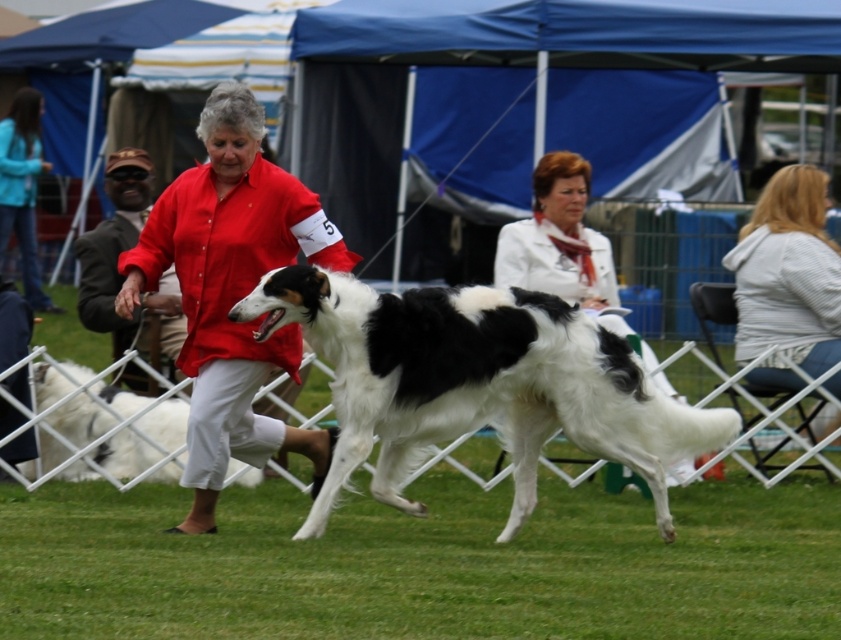
Can you confirm if light gray striped sweater at right is bigger than white fluffy dog at center?

Yes.

Is point (757, 246) positioned behind point (136, 456)?

Yes, it is behind point (136, 456).

Find the location of a particular element. The image size is (841, 640). light gray striped sweater at right is located at coordinates (787, 280).

Between point (252, 477) and point (6, 164), which one is positioned in front?

Point (252, 477) is more forward.

Who is positioned more to the left, white fluffy dog at center or matte teal jacket at upper left?

matte teal jacket at upper left is more to the left.

Image resolution: width=841 pixels, height=640 pixels. What do you see at coordinates (147, 444) in the screenshot? I see `white fluffy dog at center` at bounding box center [147, 444].

I want to click on white fluffy dog at center, so click(147, 444).

Does point (231, 180) come behind point (90, 240)?

No, it is not.

Between matte red shirt at center and red cotton shirt at center, which one is positioned lower?

matte red shirt at center is below.

You are a GUI agent. You are given a task and a screenshot of the screen. Output one action in this format:
    pyautogui.click(x=<x>, y=<y>)
    Task: Click on the matte red shirt at center
    
    Given the screenshot: What is the action you would take?
    pyautogui.click(x=231, y=291)